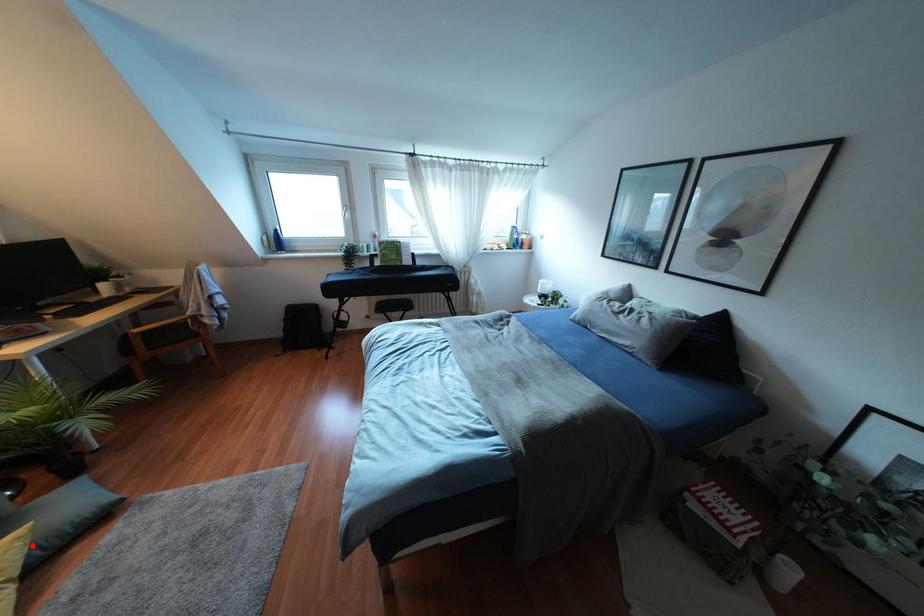
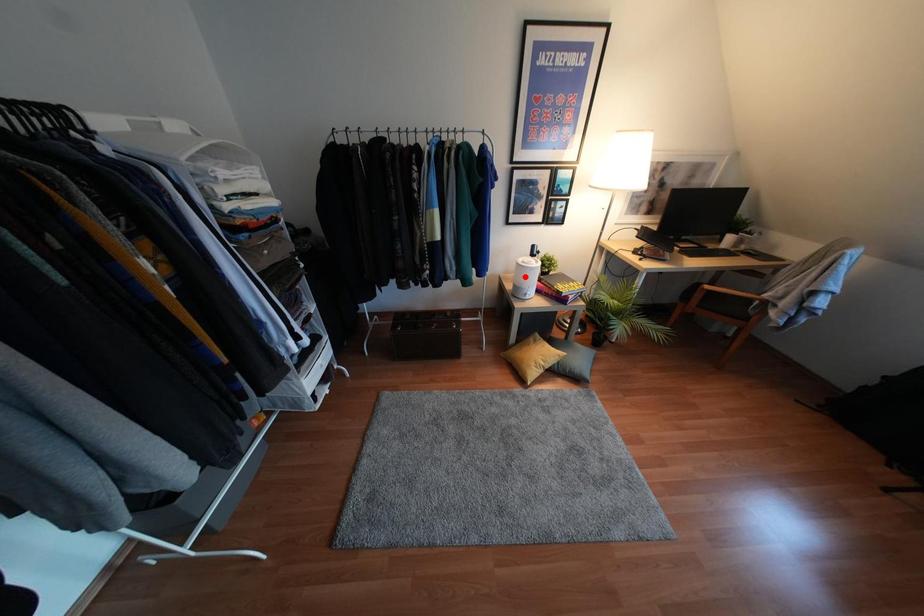
I am providing you with two images of the same scene from different viewpoints. A red point is marked on the first image and another point is marked on the second image. Are the points marked in image1 and image2 representing the same 3D position?

No